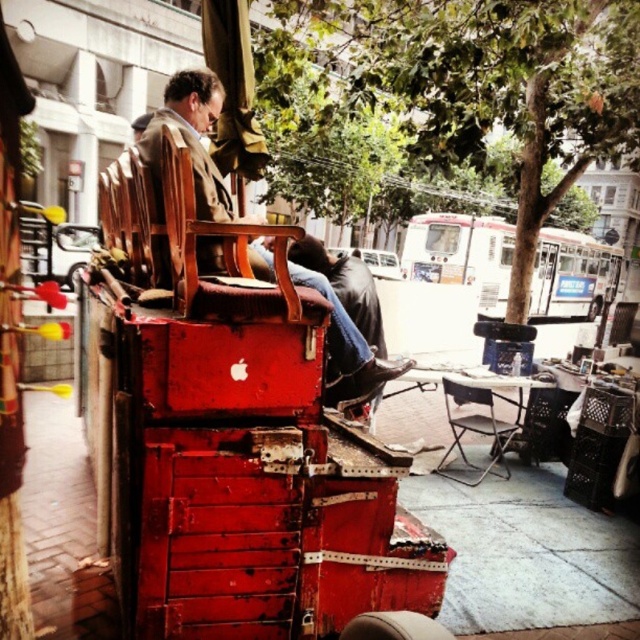
You are planning to seat two people in the space between the wooden chair at center and the metallic silver folding chair at center. Considering their widths, which chair would require more space to accommodate comfortably?

The wooden chair at center has a greater width than the metallic silver folding chair at center, so it would require more space to accommodate comfortably.